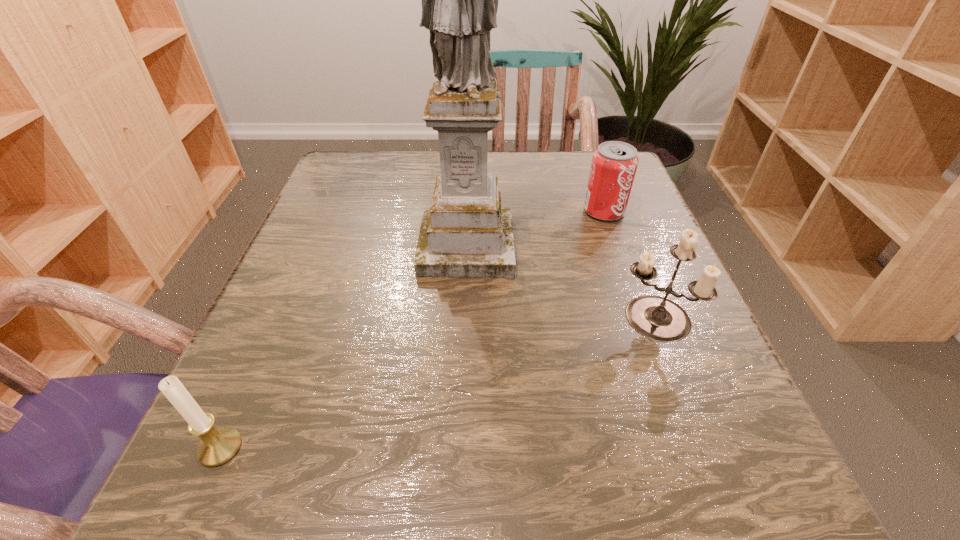
This screenshot has width=960, height=540. Find the location of `empty space between the nearest object and the farther candle holder`. empty space between the nearest object and the farther candle holder is located at coordinates (437, 383).

At what (x,y) coordinates should I click in order to perform the action: click on empty space that is in between the soda can and the left candle holder. Please return your answer as a coordinate pair (x, y). This screenshot has height=540, width=960. Looking at the image, I should click on (412, 329).

You are a GUI agent. You are given a task and a screenshot of the screen. Output one action in this format:
    pyautogui.click(x=<x>, y=<y>)
    Task: Click on the free area in between the tallest object and the farther candle holder
    The image size is (960, 540).
    Given the screenshot: What is the action you would take?
    pyautogui.click(x=560, y=282)

Identify which object is the closest to the tallest object. Please provide its 2D coordinates. Your answer should be formatted as a tuple, i.e. [(x, y)], where the tuple contains the x and y coordinates of a point satisfying the conditions above.

[(614, 164)]

Point out which object is positioned as the nearest to the nearer candle holder. Please provide its 2D coordinates. Your answer should be formatted as a tuple, i.e. [(x, y)], where the tuple contains the x and y coordinates of a point satisfying the conditions above.

[(465, 233)]

Identify the location of free point that satisfies the following two spatial constraints: 1. on the front side of the farther candle holder; 2. on the right side of the soda can. (642, 318).

The height and width of the screenshot is (540, 960). Find the location of `vacant space that satisfies the following two spatial constraints: 1. on the front side of the soda can; 2. on the right side of the farther candle holder`. vacant space that satisfies the following two spatial constraints: 1. on the front side of the soda can; 2. on the right side of the farther candle holder is located at coordinates (642, 318).

You are a GUI agent. You are given a task and a screenshot of the screen. Output one action in this format:
    pyautogui.click(x=<x>, y=<y>)
    Task: Click on the free space that satisfies the following two spatial constraints: 1. on the front-facing side of the third object from right to left; 2. on the right side of the third farthest object
    
    Given the screenshot: What is the action you would take?
    pyautogui.click(x=464, y=318)

Locate an element on the screen. vacant space that satisfies the following two spatial constraints: 1. on the front-facing side of the farther candle holder; 2. on the right side of the sculpture is located at coordinates (464, 318).

The image size is (960, 540). Identify the location of vacant region that satisfies the following two spatial constraints: 1. on the back side of the third farthest object; 2. on the left side of the nearer candle holder. (278, 318).